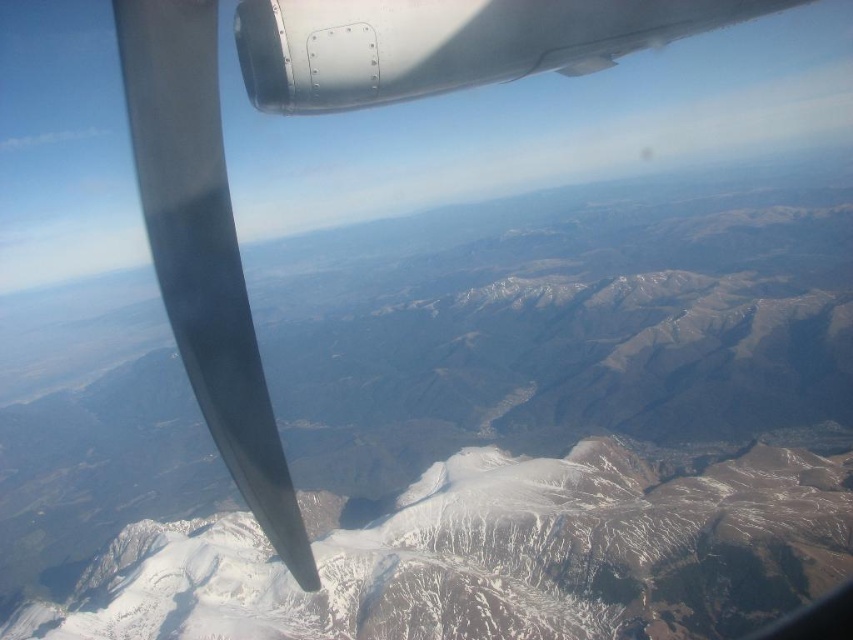
Question: Which of the following is the farthest from the observer?

Choices:
 (A) (602, 474)
 (B) (260, 404)
 (C) (584, 35)

Answer: (A)

Question: Does white snow-covered mountain at center appear on the left side of metallic gray wing at upper left?

Choices:
 (A) yes
 (B) no

Answer: (B)

Question: Is white snow-covered mountain at center above metallic gray propeller at upper left?

Choices:
 (A) yes
 (B) no

Answer: (B)

Question: Is white snow-covered mountain at center above metallic gray propeller at upper left?

Choices:
 (A) no
 (B) yes

Answer: (A)

Question: Which object appears closest to the camera in this image?

Choices:
 (A) white snow-covered mountain at center
 (B) metallic gray propeller at upper left
 (C) metallic gray wing at upper left

Answer: (B)

Question: Which point is closer to the camera?

Choices:
 (A) metallic gray propeller at upper left
 (B) metallic gray wing at upper left
 (C) white snow-covered mountain at center

Answer: (A)